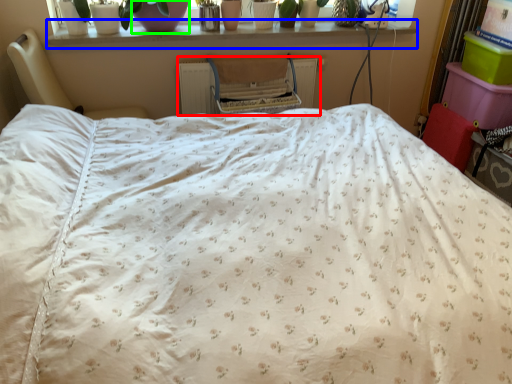
Question: Considering the real-world distances, which object is closest to radiator (highlighted by a red box)? window sill (highlighted by a blue box) or glass vase (highlighted by a green box).

Choices:
 (A) window sill
 (B) glass vase

Answer: (A)